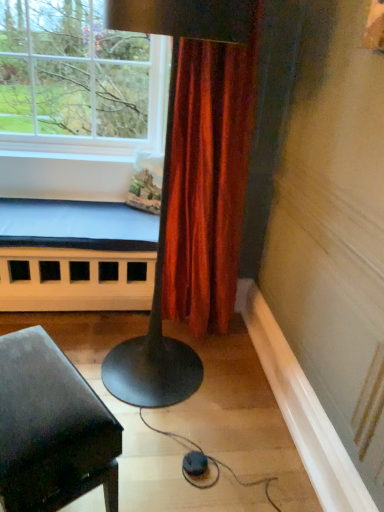
Question: Considering the relative sizes of matte black piano at lower left and white painted wood bed frame at lower left in the image provided, is matte black piano at lower left shorter than white painted wood bed frame at lower left?

Choices:
 (A) no
 (B) yes

Answer: (B)

Question: Does matte black piano at lower left have a greater width compared to white painted wood bed frame at lower left?

Choices:
 (A) yes
 (B) no

Answer: (B)

Question: Is matte black piano at lower left aimed at white painted wood bed frame at lower left?

Choices:
 (A) yes
 (B) no

Answer: (B)

Question: Would you consider matte black piano at lower left to be distant from white painted wood bed frame at lower left?

Choices:
 (A) no
 (B) yes

Answer: (B)

Question: Does matte black piano at lower left have a smaller size compared to white painted wood bed frame at lower left?

Choices:
 (A) no
 (B) yes

Answer: (B)

Question: Relative to white painted wood bed frame at lower left, is clear glass window at upper left in front or behind?

Choices:
 (A) behind
 (B) front

Answer: (B)

Question: Considering the positions of clear glass window at upper left and white painted wood bed frame at lower left in the image, is clear glass window at upper left wider or thinner than white painted wood bed frame at lower left?

Choices:
 (A) wide
 (B) thin

Answer: (A)

Question: Is clear glass window at upper left taller or shorter than white painted wood bed frame at lower left?

Choices:
 (A) short
 (B) tall

Answer: (B)

Question: From the image's perspective, relative to white painted wood bed frame at lower left, is clear glass window at upper left above or below?

Choices:
 (A) above
 (B) below

Answer: (A)

Question: In terms of width, does matte black piano at lower left look wider or thinner when compared to white painted wood bed frame at lower left?

Choices:
 (A) wide
 (B) thin

Answer: (B)

Question: From the image's perspective, is matte black piano at lower left located above or below white painted wood bed frame at lower left?

Choices:
 (A) below
 (B) above

Answer: (A)

Question: Is matte black piano at lower left to the left or to the right of white painted wood bed frame at lower left in the image?

Choices:
 (A) right
 (B) left

Answer: (A)

Question: Considering the positions of point (112, 477) and point (99, 302), is point (112, 477) closer or farther from the camera than point (99, 302)?

Choices:
 (A) farther
 (B) closer

Answer: (B)

Question: From the image's perspective, is white painted wood bed frame at lower left positioned above or below clear glass window at upper left?

Choices:
 (A) above
 (B) below

Answer: (B)

Question: Considering the positions of white painted wood bed frame at lower left and clear glass window at upper left in the image, is white painted wood bed frame at lower left taller or shorter than clear glass window at upper left?

Choices:
 (A) short
 (B) tall

Answer: (A)